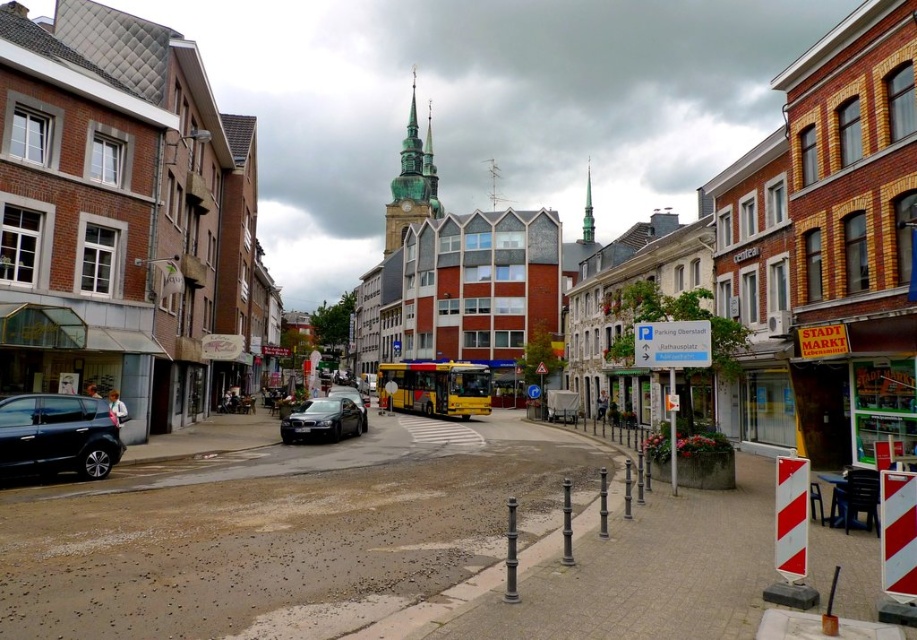
Question: Which object is the farthest from the greenish copper spire at center?

Choices:
 (A) satin black sedan at center
 (B) green copper spire at center
 (C) shiny black car at lower left

Answer: (C)

Question: Considering the relative positions of green copper spire at center and satin black sedan at center in the image provided, where is green copper spire at center located with respect to satin black sedan at center?

Choices:
 (A) below
 (B) above

Answer: (B)

Question: Among these points, which one is nearest to the camera?

Choices:
 (A) (593, 225)
 (B) (321, 435)

Answer: (B)

Question: Which point is farther to the camera?

Choices:
 (A) shiny black car at lower left
 (B) green copper spire at center

Answer: (B)

Question: Is shiny black sedan at center above satin black sedan at center?

Choices:
 (A) yes
 (B) no

Answer: (A)

Question: Is greenish copper spire at center positioned in front of shiny black sedan at center?

Choices:
 (A) yes
 (B) no

Answer: (B)